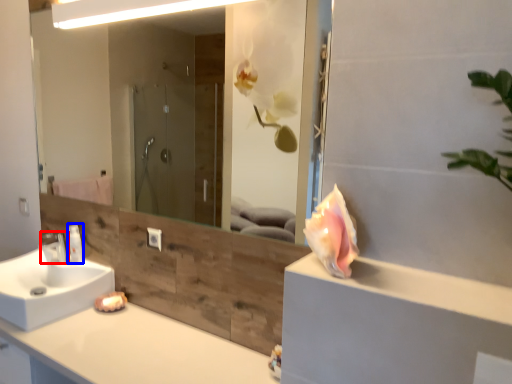
Question: Which object appears closest to the camera in this image, tap (highlighted by a red box) or toiletry (highlighted by a blue box)?

Choices:
 (A) tap
 (B) toiletry

Answer: (A)